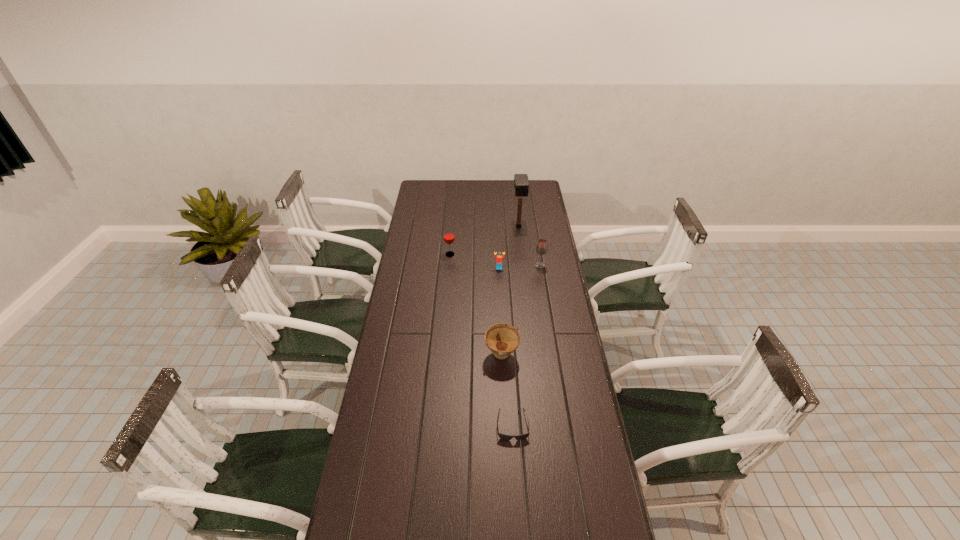
Where is `the nearest object`? The height and width of the screenshot is (540, 960). the nearest object is located at coordinates (506, 437).

At what (x,y) coordinates should I click in order to perform the action: click on vacant space situated 0.100m on the right of the fifth object from left to right. Please return your answer as a coordinate pair (x, y). The image size is (960, 540). Looking at the image, I should click on (543, 226).

Where is `free spot located on the front of the right glass`? Image resolution: width=960 pixels, height=540 pixels. free spot located on the front of the right glass is located at coordinates (546, 305).

Locate an element on the screen. The width and height of the screenshot is (960, 540). free space located on the front of the second farthest object is located at coordinates (447, 291).

Locate an element on the screen. vacant region located on the front of the fifth farthest object is located at coordinates (506, 446).

Identify the location of vacant space located 0.350m on the face of the fifth tallest object. click(502, 321).

Identify the location of vacant area located on the front-facing side of the shortest object. This screenshot has width=960, height=540. (516, 496).

Locate an element on the screen. This screenshot has width=960, height=540. mallet located at the right edge is located at coordinates (521, 183).

This screenshot has width=960, height=540. I want to click on glass drink container positioned at the right edge, so click(x=541, y=248).

I want to click on free space at the far edge of the desktop, so pos(514,191).